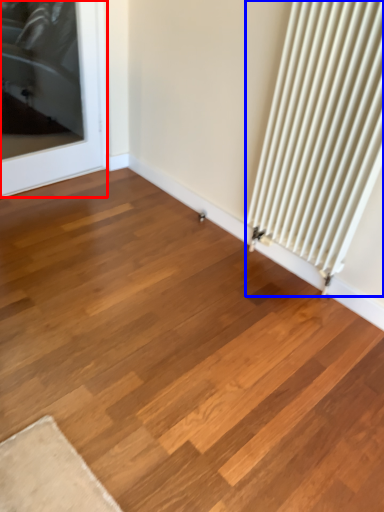
Question: Which object is further to the camera taking this photo, door (highlighted by a red box) or radiator (highlighted by a blue box)?

Choices:
 (A) door
 (B) radiator

Answer: (A)